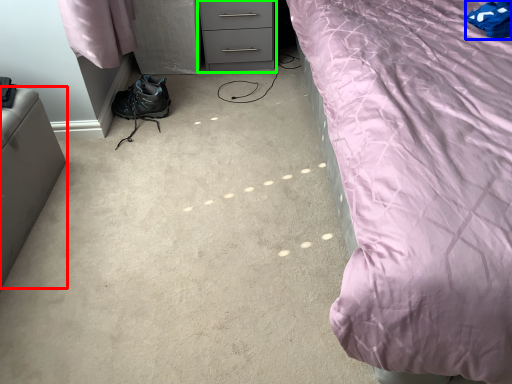
Question: Based on their relative distances, which object is farther from furniture (highlighted by a red box)? Choose from pillow (highlighted by a blue box) and chest of drawers (highlighted by a green box).

Choices:
 (A) pillow
 (B) chest of drawers

Answer: (A)